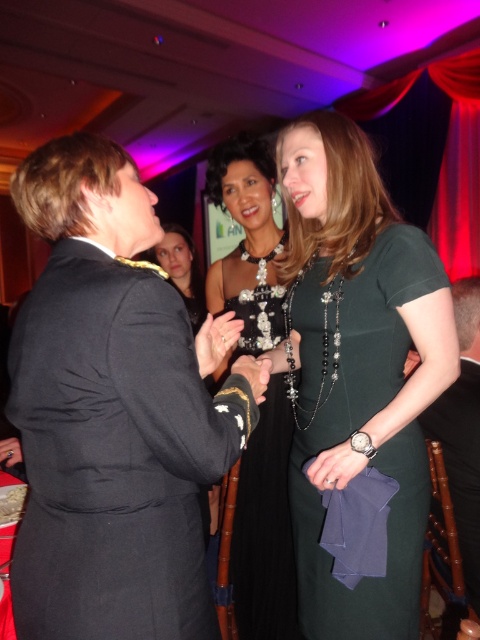
You are at the event and want to approach the woman in the dark suit with a gold chain necklace. Given that you are standing at the point marked by coordinates point (113,412), which is on the black fabric suit at left, can you directly reach her without moving past the woman in the dark green dress?

The point marked by coordinates point (113,412) is already on the black fabric suit at left, so you are already at the location of the woman in the dark suit with a gold chain necklace. Therefore, you don not need to move past the woman in the dark green dress to reach her.

You are standing at the entrance of the banquet hall and see two points marked in the image. The first point is at coordinate point (276, 413) and the second point is at coordinate point (477, 296). Which point is closer to you?

Point (276, 413) is in front of point (477, 296), so it is closer to you.

You are organizing a photo shoot and need to arrange two dresses in the center of the frame. The black satin dress at center and the black fabric dress at center must be placed side by side. Which dress should be positioned to the left to ensure they fit within the 1.2 meters allocated space?

The black fabric dress at center should be positioned to the left since it is narrower than the black satin dress at center, allowing both to fit within the 1.2 meters space.